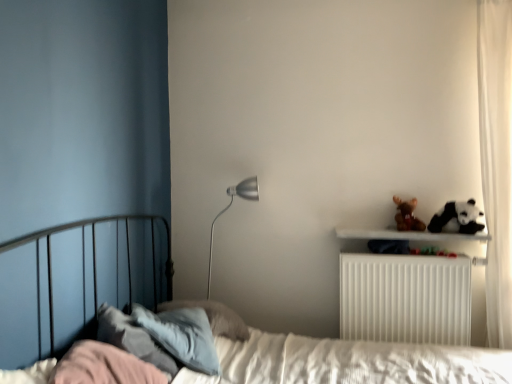
Question: Does black and white plush panda at upper right turn towards silver metallic floor lamp at center?

Choices:
 (A) yes
 (B) no

Answer: (B)

Question: Is black and white plush panda at upper right facing away from silver metallic floor lamp at center?

Choices:
 (A) yes
 (B) no

Answer: (B)

Question: Are black and white plush panda at upper right and silver metallic floor lamp at center beside each other?

Choices:
 (A) no
 (B) yes

Answer: (A)

Question: Is black and white plush panda at upper right at the right side of silver metallic floor lamp at center?

Choices:
 (A) yes
 (B) no

Answer: (A)

Question: Can you confirm if black and white plush panda at upper right is taller than silver metallic floor lamp at center?

Choices:
 (A) no
 (B) yes

Answer: (A)

Question: From the image's perspective, is white quilted bed at center above or below white plastic radiator at upper right?

Choices:
 (A) below
 (B) above

Answer: (A)

Question: Is white quilted bed at center inside or outside of white plastic radiator at upper right?

Choices:
 (A) outside
 (B) inside

Answer: (A)

Question: From a real-world perspective, is white quilted bed at center physically located above or below white plastic radiator at upper right?

Choices:
 (A) below
 (B) above

Answer: (A)

Question: Considering the positions of point pos(206,304) and point pos(450,321), is point pos(206,304) closer or farther from the camera than point pos(450,321)?

Choices:
 (A) farther
 (B) closer

Answer: (A)

Question: Is point (488, 104) closer or farther from the camera than point (445, 210)?

Choices:
 (A) closer
 (B) farther

Answer: (A)

Question: Considering the relative positions of white sheer curtain at right and black and white plush panda at upper right in the image provided, is white sheer curtain at right to the left or to the right of black and white plush panda at upper right?

Choices:
 (A) right
 (B) left

Answer: (A)

Question: From a real-world perspective, is white sheer curtain at right above or below black and white plush panda at upper right?

Choices:
 (A) above
 (B) below

Answer: (A)

Question: In terms of width, does white sheer curtain at right look wider or thinner when compared to black and white plush panda at upper right?

Choices:
 (A) thin
 (B) wide

Answer: (B)

Question: Looking at their shapes, would you say white plastic radiator at upper right is wider or thinner than brown plush bear at upper right?

Choices:
 (A) thin
 (B) wide

Answer: (B)

Question: Is point (416, 309) closer or farther from the camera than point (400, 205)?

Choices:
 (A) closer
 (B) farther

Answer: (A)